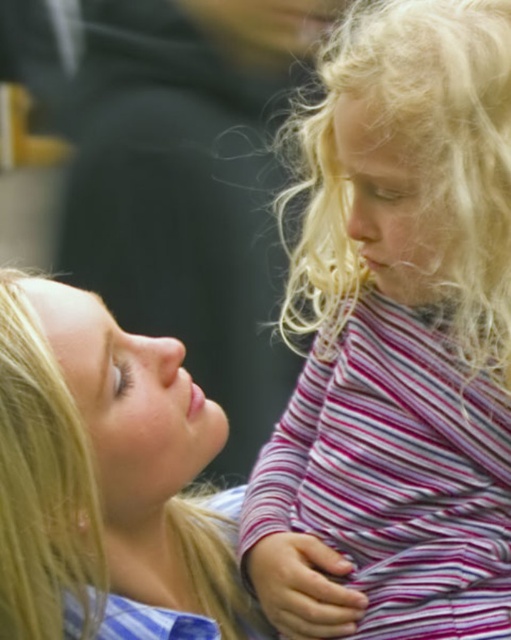
Is striped fabric dress at right taller than blonde hair at upper left?

Yes, striped fabric dress at right is taller than blonde hair at upper left.

The width and height of the screenshot is (511, 640). Describe the element at coordinates (397, 340) in the screenshot. I see `striped fabric dress at right` at that location.

Measure the distance between point (456, 131) and camera.

A distance of 3.47 feet exists between point (456, 131) and camera.

Where is `striped fabric dress at right`? striped fabric dress at right is located at coordinates (397, 340).